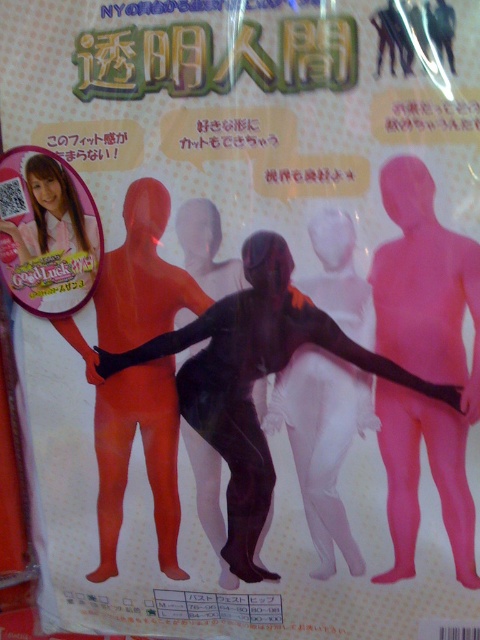
You are a photographer setting up a shoot for the Transparent People body suits. You have two points marked on your camera screen for focus adjustments. The first point is at coordinates point (238, 490) and the second is at point (342, 320). Which point is closer to you, the photographer?

Point (238, 490) is closer to the photographer than point (342, 320) because it is further to the viewer.

You are a customer trying to choose between the pink matte bodysuit at center and the black matte bodysuit at center. Based on the image, which one do you think has a wider design?

The pink matte bodysuit at center might be wider than black matte bodysuit at center according to the description.

You are a fashion designer looking to create a new collection. You have two suits in front of you, the pink matte bodysuit at center and the black spandex suit at center. Which one would take up more space in your storage room if you were to stack them neatly?

The black spandex suit at center takes up more space than the pink matte bodysuit at center because the pink matte bodysuit at center occupies less space than the black spandex suit at center.